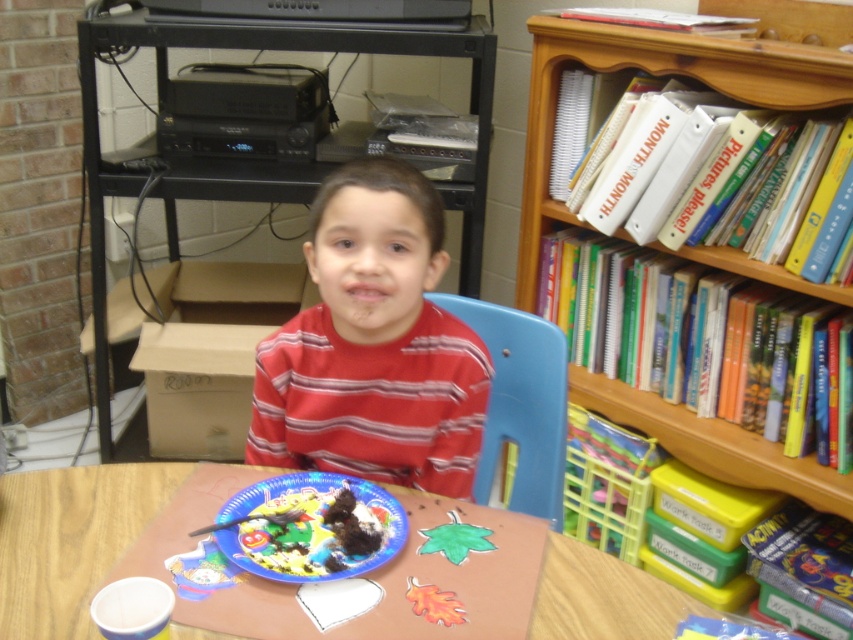
Does point (387, 307) lie behind point (785, 54)?

No, it is in front of (785, 54).

Who is more distant from viewer, (322, 420) or (756, 76)?

Positioned behind is point (756, 76).

Which is in front, point (445, 490) or point (654, 49)?

Point (445, 490)

Locate an element on the screen. The width and height of the screenshot is (853, 640). red striped shirt at center is located at coordinates (373, 346).

The height and width of the screenshot is (640, 853). What do you see at coordinates (654, 74) in the screenshot?
I see `wooden bookcase at upper right` at bounding box center [654, 74].

Is wooden bookcase at upper right thinner than chocolate cake at center?

In fact, wooden bookcase at upper right might be wider than chocolate cake at center.

Which is in front, point (641, 422) or point (366, 504)?

Positioned in front is point (366, 504).

Where is `wooden bookcase at upper right`? This screenshot has height=640, width=853. wooden bookcase at upper right is located at coordinates (654, 74).

Does point (389, 336) come behind point (93, 532)?

That is True.

Can you confirm if red striped shirt at center is thinner than brown paper table at center?

Yes, red striped shirt at center is thinner than brown paper table at center.

Is point (352, 410) in front of point (19, 598)?

No, it is not.

The height and width of the screenshot is (640, 853). I want to click on red striped shirt at center, so click(373, 346).